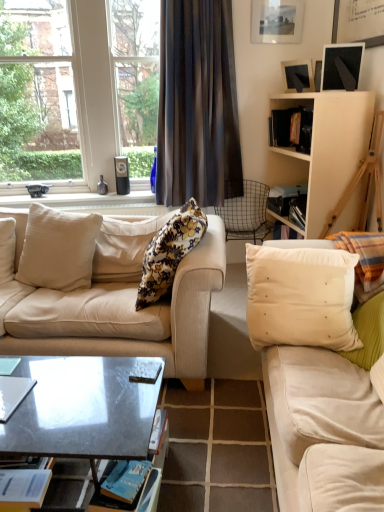
The height and width of the screenshot is (512, 384). What are the coordinates of `spots to the right of metallic gray coffee table at center` in the screenshot? It's located at (210, 449).